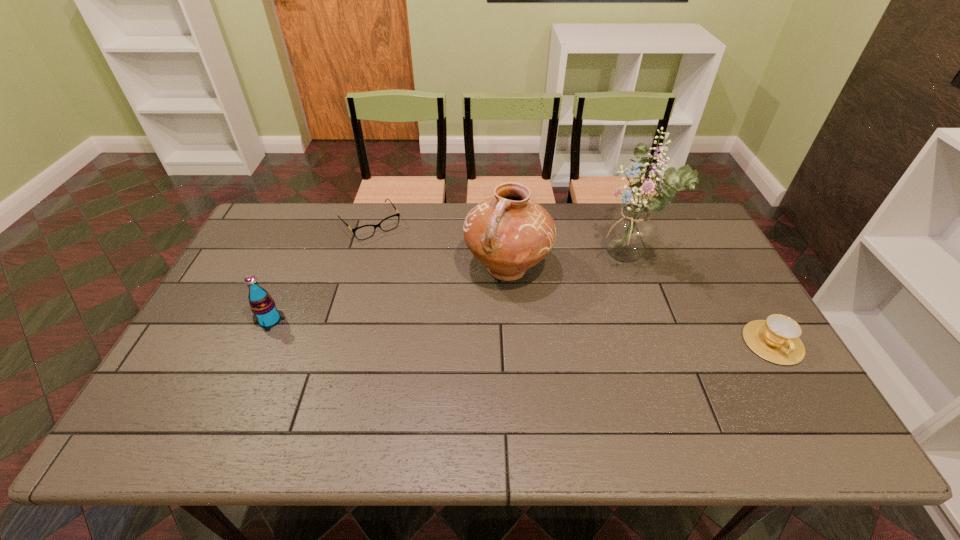
Identify the location of vacant area at the near left corner. The image size is (960, 540). (191, 389).

The width and height of the screenshot is (960, 540). I want to click on free location at the near right corner of the desktop, so (735, 387).

Find the location of a particular element. This screenshot has width=960, height=540. free space between the bouquet and the second tallest object is located at coordinates (565, 264).

Where is `free spot between the cup and the second object from left to right`? This screenshot has width=960, height=540. free spot between the cup and the second object from left to right is located at coordinates (571, 284).

The image size is (960, 540). I want to click on free area in between the spectacles and the rightmost object, so click(x=571, y=284).

You are a GUI agent. You are given a task and a screenshot of the screen. Output one action in this format:
    pyautogui.click(x=<x>, y=<y>)
    Task: Click on the free spot between the bouquet and the fourth tallest object
    This screenshot has height=540, width=960.
    Given the screenshot: What is the action you would take?
    click(699, 301)

Where is `vacant point located between the cup and the pottery`? vacant point located between the cup and the pottery is located at coordinates (640, 306).

Identify the location of vacant area between the cup and the bouquet. (699, 301).

Where is `free area in between the fourth shortest object and the third shortest object`? free area in between the fourth shortest object and the third shortest object is located at coordinates (389, 294).

You are a GUI agent. You are given a task and a screenshot of the screen. Output one action in this format:
    pyautogui.click(x=<x>, y=<y>)
    Task: Click on the free spot between the fourth tallest object and the soda
    
    Given the screenshot: What is the action you would take?
    pyautogui.click(x=521, y=332)